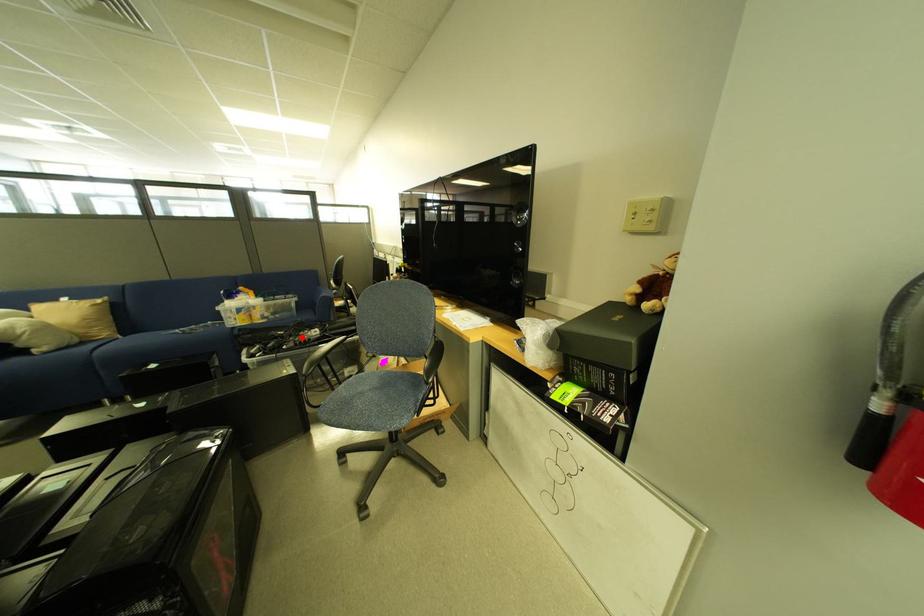
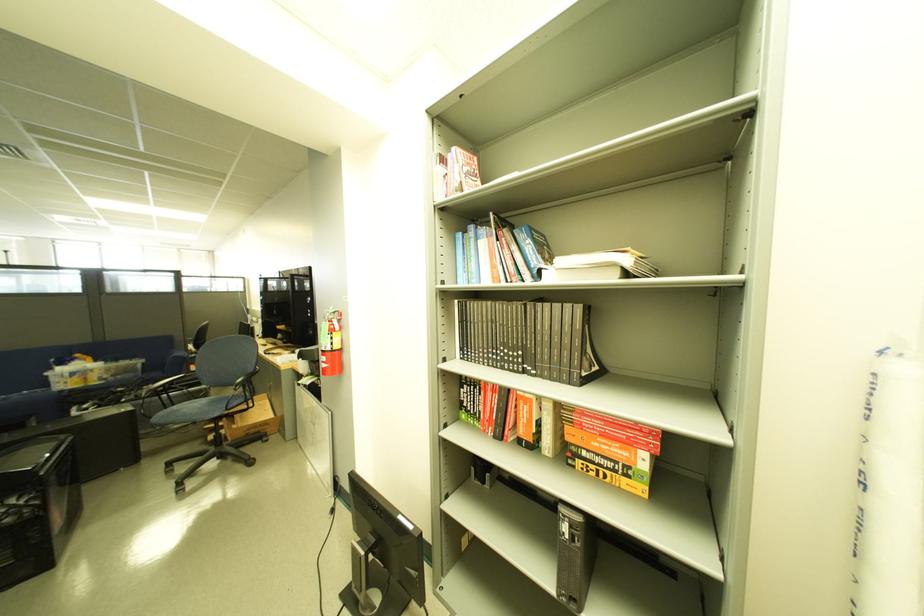
In the second image, find the point that corresponds to the highlighted location in the first image.

(142, 392)